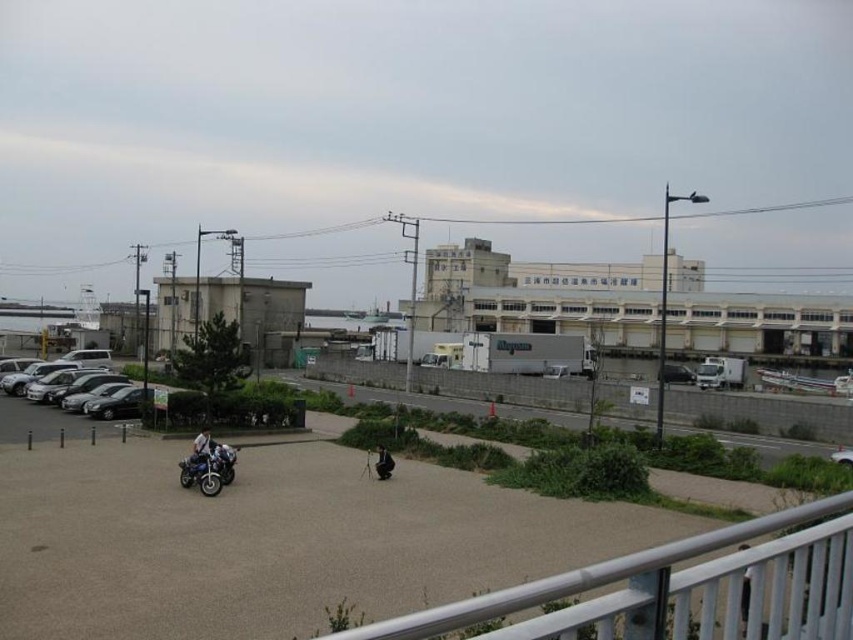
Is shiny black motorcycle at lower left to the left of metallic silver car at center from the viewer's perspective?

Yes, shiny black motorcycle at lower left is to the left of metallic silver car at center.

Does shiny black motorcycle at lower left have a greater width compared to metallic silver car at center?

No, shiny black motorcycle at lower left is not wider than metallic silver car at center.

Is point (224, 456) positioned after point (670, 378)?

No, it is not.

Where is `shiny black motorcycle at lower left`? This screenshot has height=640, width=853. shiny black motorcycle at lower left is located at coordinates (207, 465).

In order to click on silver metallic rail at lower right in this screenshot , I will do `click(676, 589)`.

Where is `silver metallic rail at lower right`? silver metallic rail at lower right is located at coordinates (676, 589).

Is silver metallic car at left to the left of metallic silver car at center from the viewer's perspective?

Correct, you'll find silver metallic car at left to the left of metallic silver car at center.

Between point (71, 385) and point (689, 384), which one is positioned behind?

The point (689, 384) is more distant.

Find the location of a particular element. The image size is (853, 640). silver metallic car at left is located at coordinates (65, 387).